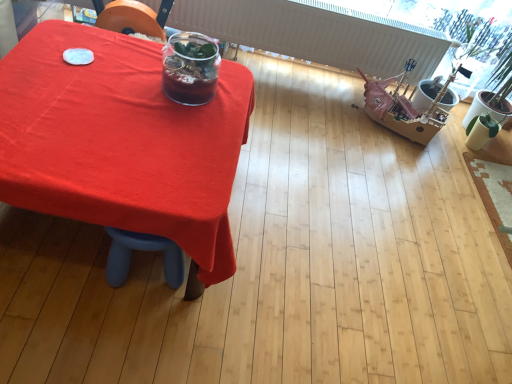
Where is `unoccupied region to the right of translucent glass jar at center`? This screenshot has width=512, height=384. unoccupied region to the right of translucent glass jar at center is located at coordinates (230, 103).